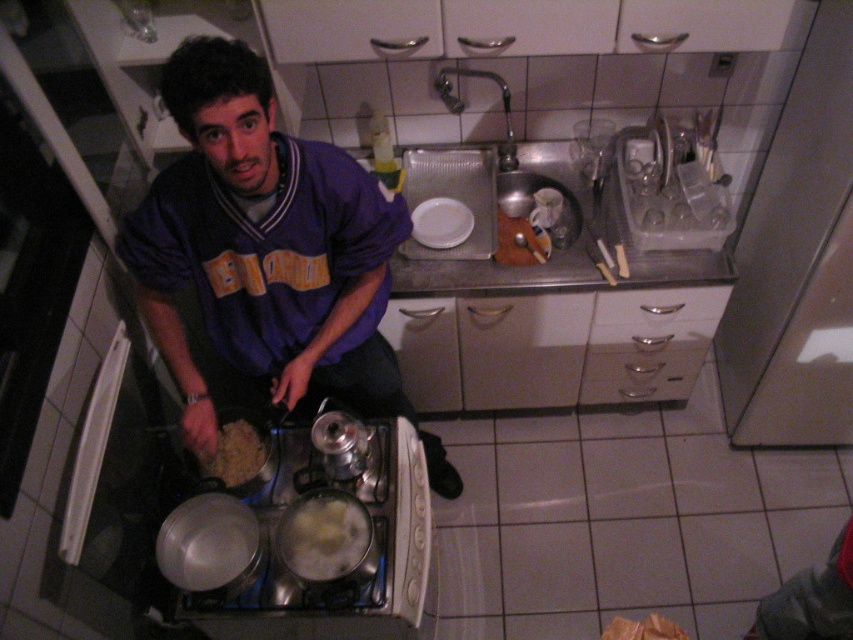
Measure the distance between brown matte rice at lower center and camera.

They are 1.47 meters apart.

The height and width of the screenshot is (640, 853). Describe the element at coordinates (236, 454) in the screenshot. I see `brown matte rice at lower center` at that location.

Where is `brown matte rice at lower center`? brown matte rice at lower center is located at coordinates (236, 454).

Does white creamy food at lower center have a greater height compared to brown matte rice at lower center?

Yes, white creamy food at lower center is taller than brown matte rice at lower center.

Is point (343, 493) farther from camera compared to point (236, 428)?

No, (343, 493) is closer to viewer.

You are a GUI agent. You are given a task and a screenshot of the screen. Output one action in this format:
    pyautogui.click(x=<x>, y=<y>)
    Task: Click on the white creamy food at lower center
    The height and width of the screenshot is (640, 853).
    Given the screenshot: What is the action you would take?
    pyautogui.click(x=323, y=536)

Describe the element at coordinates (264, 248) in the screenshot. I see `purple jersey at center` at that location.

Is purple jersey at center below white matte plate at center?

Yes.

What are the coordinates of `purple jersey at center` in the screenshot? It's located at (264, 248).